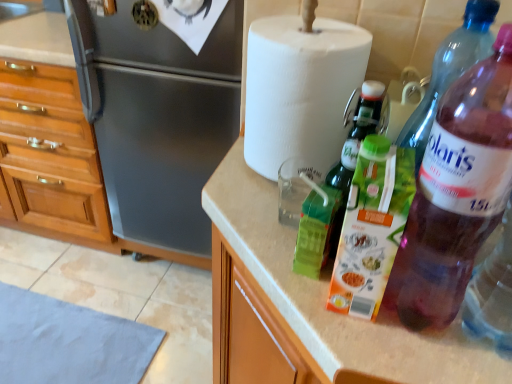
Question: From a real-world perspective, is green matte carton at center, placed as the second bottle when sorted from back to front, physically below purple translucent bottle at right, which is counted as the first bottle, starting from the back?

Choices:
 (A) no
 (B) yes

Answer: (B)

Question: Could you tell me if green matte carton at center, placed as the second bottle when sorted from back to front, is turned towards purple translucent bottle at right, the third bottle positioned from the front?

Choices:
 (A) no
 (B) yes

Answer: (A)

Question: Is green matte carton at center, placed as the second bottle when sorted from back to front, beside purple translucent bottle at right, the third bottle positioned from the front?

Choices:
 (A) no
 (B) yes

Answer: (A)

Question: Considering the relative sizes of green matte carton at center, which appears as the second bottle when viewed from the front, and purple translucent bottle at right, the third bottle positioned from the front, in the image provided, is green matte carton at center, which appears as the second bottle when viewed from the front, bigger than purple translucent bottle at right, the third bottle positioned from the front,?

Choices:
 (A) no
 (B) yes

Answer: (A)

Question: Considering the relative sizes of green matte carton at center, which appears as the second bottle when viewed from the front, and purple translucent bottle at right, which is counted as the first bottle, starting from the back, in the image provided, is green matte carton at center, which appears as the second bottle when viewed from the front, thinner than purple translucent bottle at right, which is counted as the first bottle, starting from the back,?

Choices:
 (A) yes
 (B) no

Answer: (A)

Question: Which is correct: white paper towel at upper center is inside purple translucent bottle at right, the third bottle positioned from the front, or outside of it?

Choices:
 (A) outside
 (B) inside

Answer: (A)

Question: From the image's perspective, is white paper towel at upper center positioned above or below purple translucent bottle at right, the third bottle positioned from the front?

Choices:
 (A) above
 (B) below

Answer: (A)

Question: Based on their sizes in the image, would you say white paper towel at upper center is bigger or smaller than purple translucent bottle at right, the third bottle positioned from the front?

Choices:
 (A) big
 (B) small

Answer: (A)

Question: Is white paper towel at upper center to the left or to the right of purple translucent bottle at right, the third bottle positioned from the front, in the image?

Choices:
 (A) right
 (B) left

Answer: (B)

Question: Is white paper towel at upper center to the left or to the right of brushed metal refrigerator at left in the image?

Choices:
 (A) right
 (B) left

Answer: (A)

Question: From the image's perspective, is white paper towel at upper center above or below brushed metal refrigerator at left?

Choices:
 (A) below
 (B) above

Answer: (A)

Question: In terms of size, does white paper towel at upper center appear bigger or smaller than brushed metal refrigerator at left?

Choices:
 (A) small
 (B) big

Answer: (A)

Question: Considering their positions, is white paper towel at upper center located in front of or behind brushed metal refrigerator at left?

Choices:
 (A) behind
 (B) front

Answer: (B)

Question: In the image, is beige laminate countertop at center on the left side or the right side of purple translucent bottle at right, the third bottle positioned from the front?

Choices:
 (A) right
 (B) left

Answer: (B)

Question: Looking at the image, does beige laminate countertop at center seem bigger or smaller compared to purple translucent bottle at right, which is counted as the first bottle, starting from the back?

Choices:
 (A) small
 (B) big

Answer: (B)